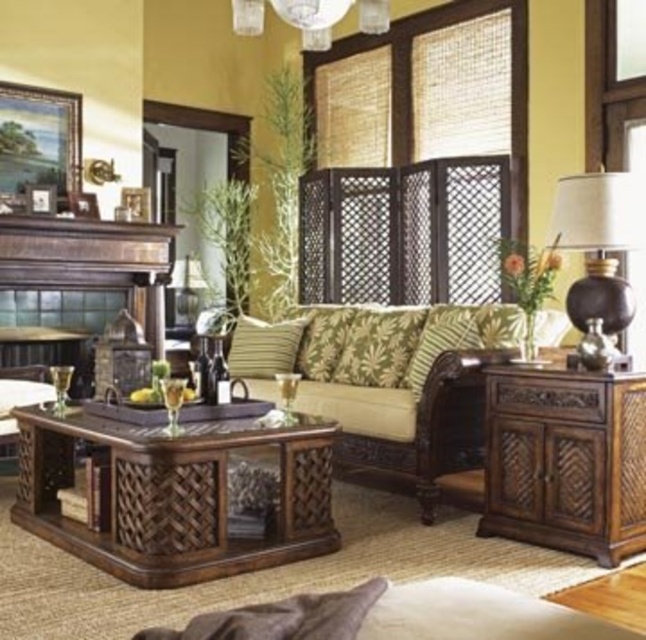
Question: In this image, where is green leafy fabric pillow at center located relative to matte glass chandelier at upper center?

Choices:
 (A) below
 (B) above

Answer: (A)

Question: Considering the relative positions of matte brown lamp at right and matte glass chandelier at upper center in the image provided, where is matte brown lamp at right located with respect to matte glass chandelier at upper center?

Choices:
 (A) right
 (B) left

Answer: (A)

Question: Among these objects, which one is nearest to the camera?

Choices:
 (A) brown woven table at center
 (B) matte black lamp at center
 (C) matte brown lamp at right
 (D) green textured fabric couch at center

Answer: (A)

Question: Where is green textured pillow at center located in relation to matte black lamp at center in the image?

Choices:
 (A) below
 (B) above

Answer: (A)

Question: Which of the following is the closest to the observer?

Choices:
 (A) rustic wood side table at right
 (B) brown woven armchair at left

Answer: (A)

Question: Based on their relative distances, which object is nearer to the green textured pillow at center?

Choices:
 (A) green striped cushion at center
 (B) dark brown leather fireplace at center

Answer: (A)